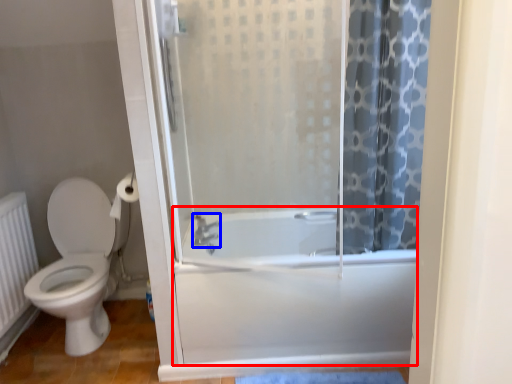
Question: Which object appears farthest to the camera in this image, bath (highlighted by a red box) or shower (highlighted by a blue box)?

Choices:
 (A) bath
 (B) shower

Answer: (B)